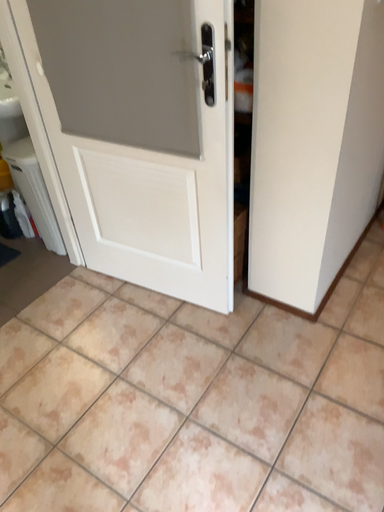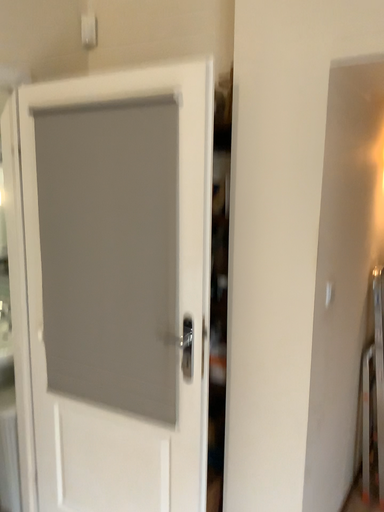
Question: How did the camera likely rotate when shooting the video?

Choices:
 (A) rotated upward
 (B) rotated downward

Answer: (A)